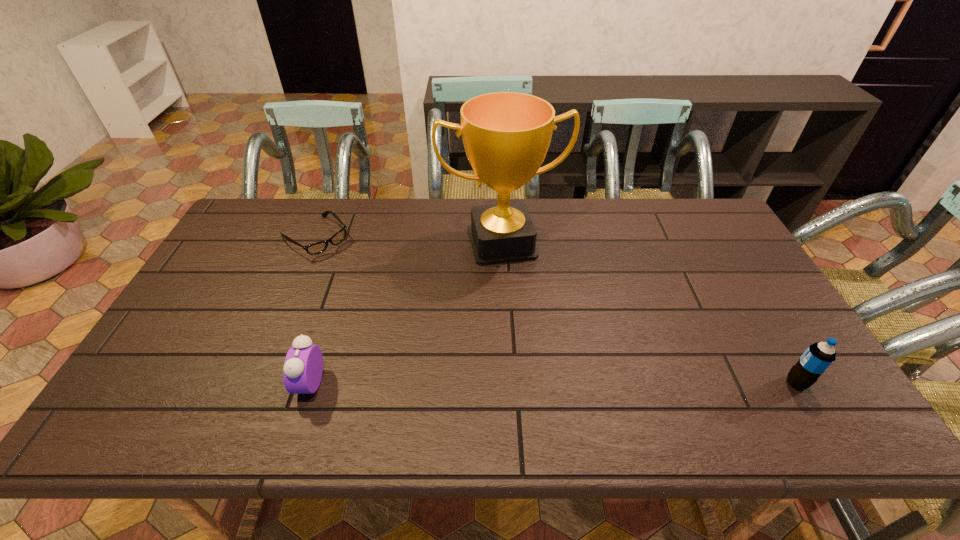
Identify the location of vacant space situated on the front-facing side of the award. The width and height of the screenshot is (960, 540). pos(537,341).

Identify the location of blank space located 0.270m on the front-facing side of the award. (536, 338).

At what (x,y) coordinates should I click in order to perform the action: click on vacant space located 0.250m on the front-facing side of the award. Please return your answer as a coordinate pair (x, y). Looking at the image, I should click on (534, 332).

You are a GUI agent. You are given a task and a screenshot of the screen. Output one action in this format:
    pyautogui.click(x=<x>, y=<y>)
    Task: Click on the blank area located on the front-facing side of the spectacles
    
    Given the screenshot: What is the action you would take?
    click(x=414, y=323)

At what (x,y) coordinates should I click in order to perform the action: click on vacant space located 0.290m on the front-facing side of the spectacles. Please return your answer as a coordinate pair (x, y). This screenshot has width=960, height=540. Looking at the image, I should click on (389, 302).

This screenshot has width=960, height=540. I want to click on vacant space located 0.280m on the front-facing side of the spectacles, so click(387, 300).

You are a GUI agent. You are given a task and a screenshot of the screen. Output one action in this format:
    pyautogui.click(x=<x>, y=<y>)
    Task: Click on the award positioned at the far edge
    
    Given the screenshot: What is the action you would take?
    pyautogui.click(x=506, y=135)

Where is `spectacles present at the far edge`? spectacles present at the far edge is located at coordinates (319, 247).

Image resolution: width=960 pixels, height=540 pixels. Find the location of `alarm clock present at the near edge`. alarm clock present at the near edge is located at coordinates (303, 367).

You are a GUI agent. You are given a task and a screenshot of the screen. Output one action in this format:
    pyautogui.click(x=<x>, y=<y>)
    Task: Click on the soda bottle located at the near edge
    The image size is (960, 540).
    Given the screenshot: What is the action you would take?
    pyautogui.click(x=818, y=357)